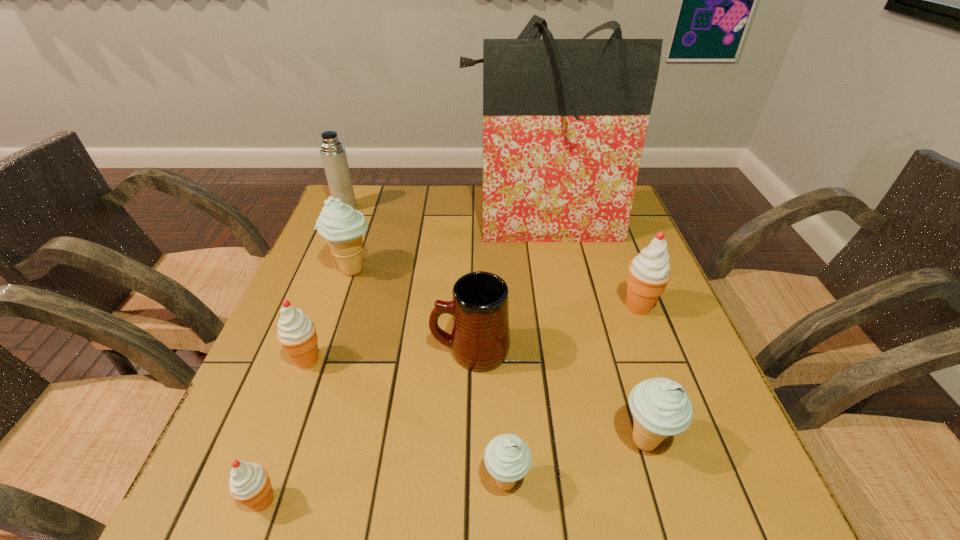
Where is `vacant space located on the side of the red mug with the handle`? Image resolution: width=960 pixels, height=540 pixels. vacant space located on the side of the red mug with the handle is located at coordinates (326, 351).

The image size is (960, 540). I want to click on blank space located on the front of the second nearest red icecream, so pos(276,446).

At what (x,y) coordinates should I click in order to perform the action: click on free point located 0.310m on the left of the rightmost beige icecream. Please return your answer as a coordinate pair (x, y). Image resolution: width=960 pixels, height=540 pixels. Looking at the image, I should click on (439, 442).

Find the location of a particular element. Image resolution: width=960 pixels, height=540 pixels. free region located 0.290m on the right of the smallest beige icecream is located at coordinates (708, 482).

I want to click on vacant area located 0.260m on the back of the smallest red icecream, so click(314, 356).

Identify the location of shopping bag located at the far edge. (564, 120).

The image size is (960, 540). Find the location of `thermos bottle that is positioned at the far edge`. thermos bottle that is positioned at the far edge is located at coordinates (333, 154).

The width and height of the screenshot is (960, 540). Identify the location of thermos bottle that is positioned at the left edge. (333, 154).

Where is `shopping bag that is positioned at the right edge`? shopping bag that is positioned at the right edge is located at coordinates (564, 120).

Identify the location of object situated at the far left corner. (333, 154).